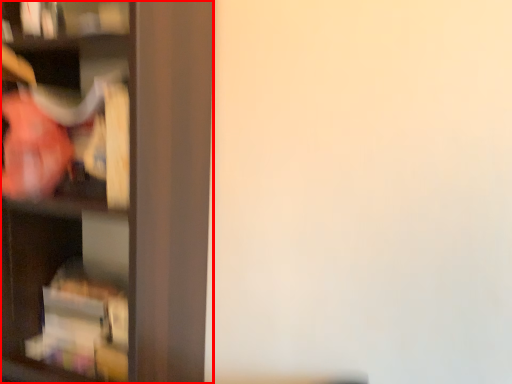
Question: From the image's perspective, where is shelf (annotated by the red box) located in relation to cabinet in the image?

Choices:
 (A) above
 (B) below

Answer: (A)